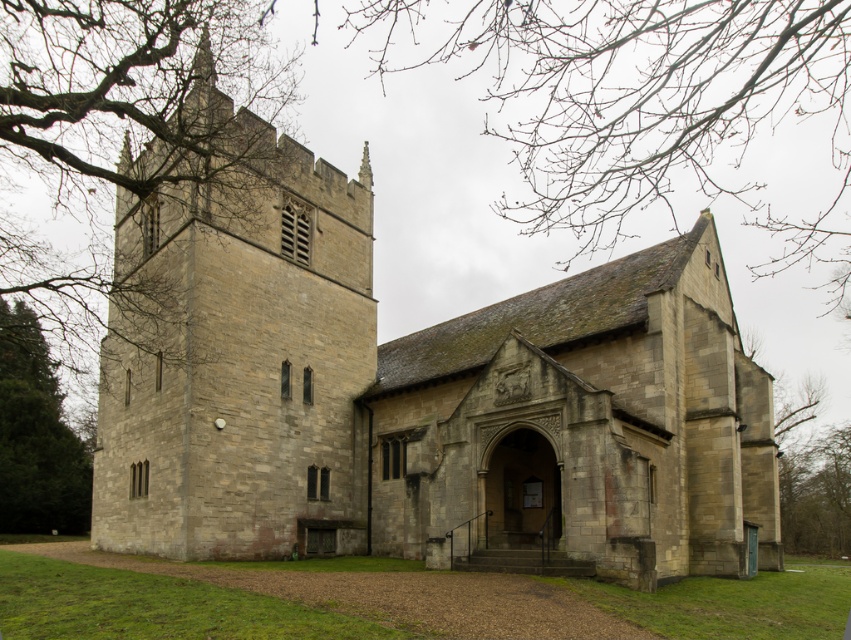
I want to click on stone church at center, so click(410, 388).

Consider the image. Is bare branches at upper left wider than green leafy tree at left?

Yes, bare branches at upper left is wider than green leafy tree at left.

Between bare branches at upper left and green leafy tree at left, which one is positioned higher?

bare branches at upper left is higher up.

Is point (29, 26) farther from camera compared to point (20, 465)?

That is False.

The height and width of the screenshot is (640, 851). I want to click on bare branches at upper left, so click(111, 131).

Consider the image. Between stone church at center and bare branches at upper left, which one is positioned lower?

stone church at center is lower down.

Between stone church at center and bare branches at upper left, which one is positioned higher?

bare branches at upper left is higher up.

Is point (283, 221) farther from camera compared to point (92, 70)?

No.

The image size is (851, 640). What are the coordinates of `stone church at center` in the screenshot? It's located at (410, 388).